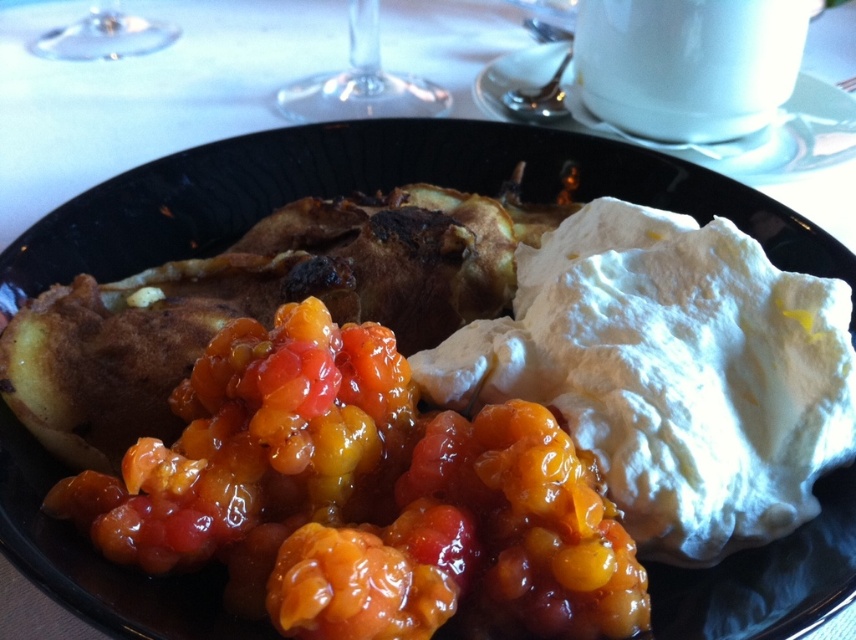
What do you see at coordinates (361, 83) in the screenshot? This screenshot has width=856, height=640. I see `transparent glass at upper center` at bounding box center [361, 83].

Does point (415, 81) come closer to viewer compared to point (70, 35)?

Yes, it is.

The width and height of the screenshot is (856, 640). In order to click on transparent glass at upper center in this screenshot , I will do `click(361, 83)`.

Between glistening orange jam at center and transparent glass at upper left, which one is positioned lower?

glistening orange jam at center is lower down.

Is glistening orange jam at center to the right of transparent glass at upper left from the viewer's perspective?

Indeed, glistening orange jam at center is positioned on the right side of transparent glass at upper left.

In order to click on glistening orange jam at center in this screenshot , I will do `click(361, 497)`.

Which is in front, point (531, 484) or point (396, 93)?

Point (531, 484) is in front.

Is glistening orange jam at center bigger than transparent glass at upper center?

Correct, glistening orange jam at center is larger in size than transparent glass at upper center.

Does point (379, 326) come behind point (438, 86)?

That is False.

Identify the location of glistening orange jam at center. (361, 497).